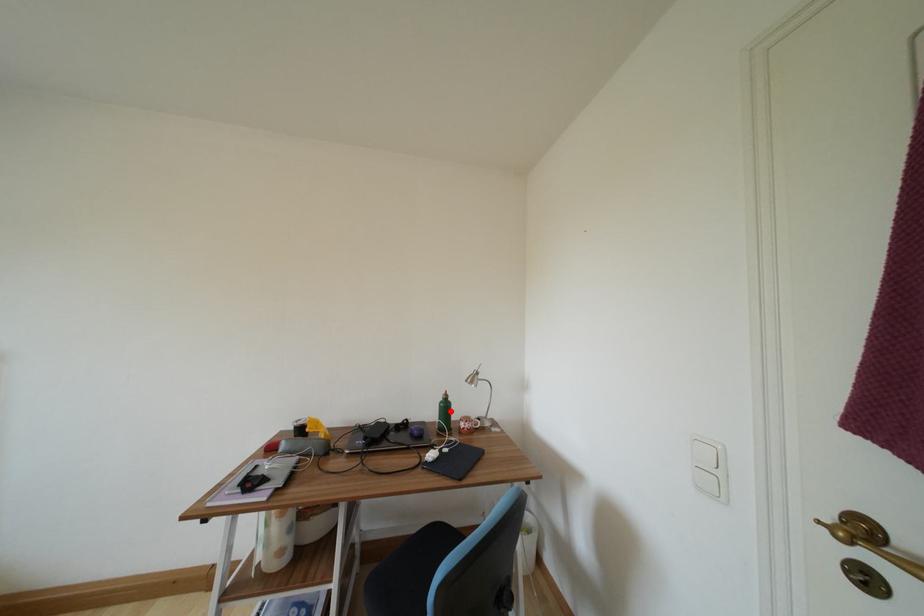
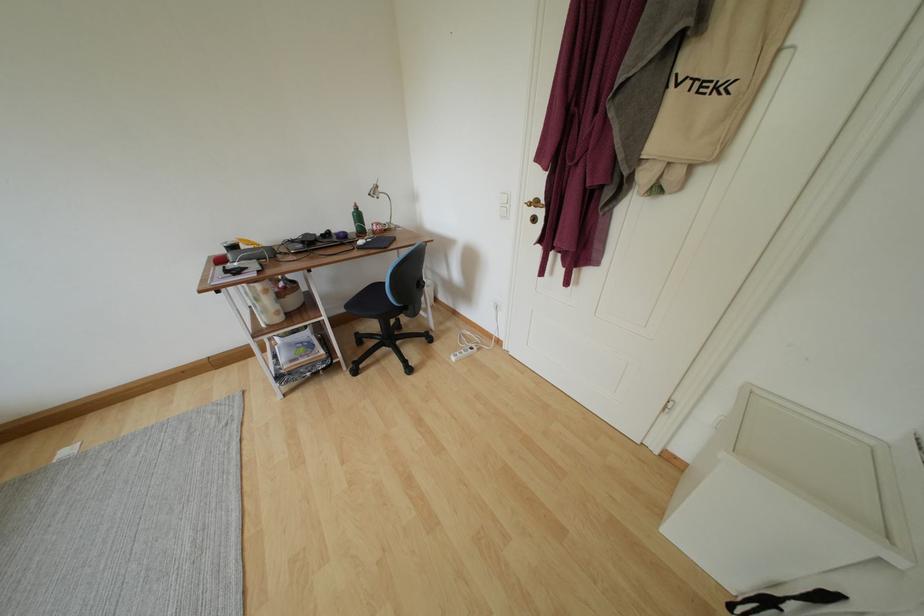
Find the pixel in the second image that matches the highlighted location in the first image.

(363, 220)